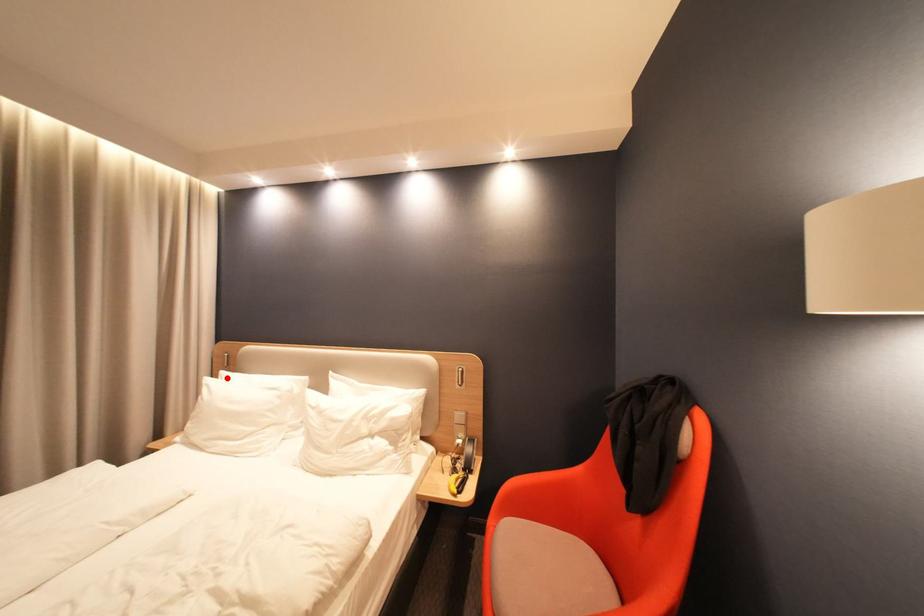
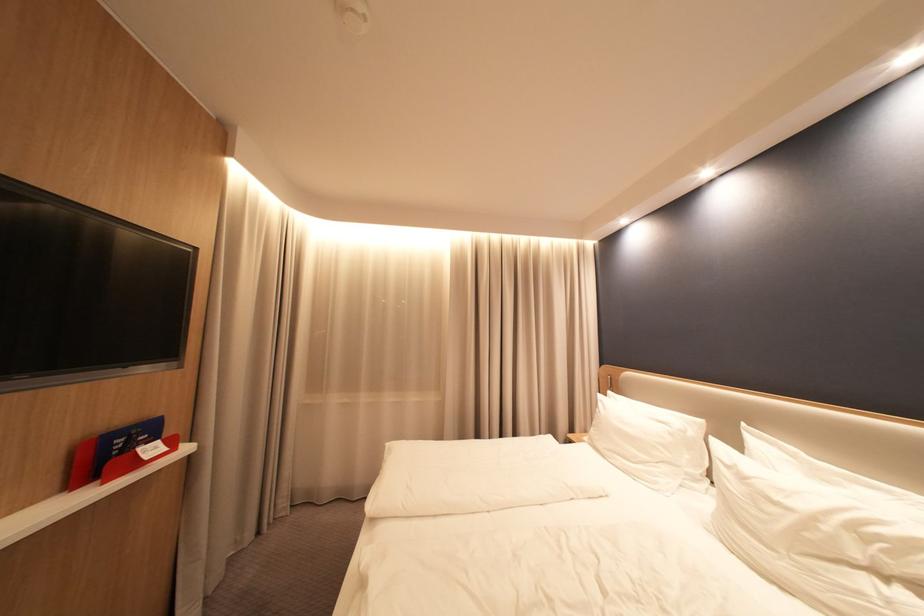
Find the pixel in the second image that matches the highlighted location in the first image.

(615, 397)